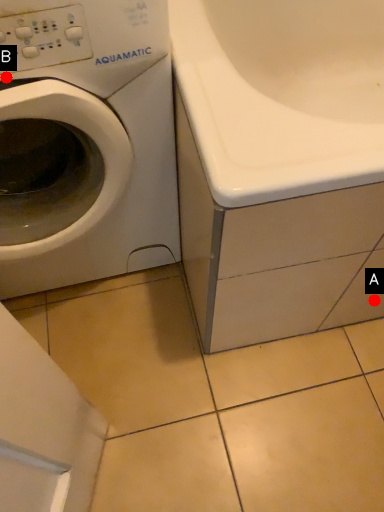
Question: Two points are circled on the image, labeled by A and B beside each circle. Among these points, which one is farthest from the camera?

Choices:
 (A) A is further
 (B) B is further

Answer: (A)